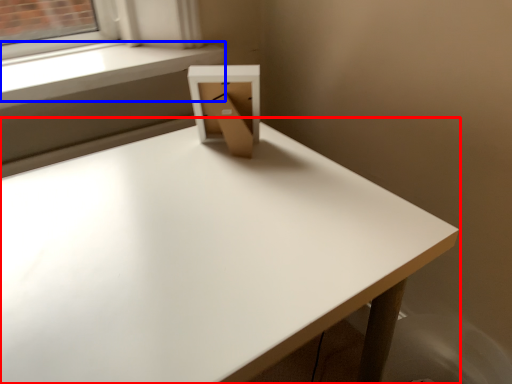
Question: Which point is further to the camera, table (highlighted by a red box) or window sill (highlighted by a blue box)?

Choices:
 (A) table
 (B) window sill

Answer: (B)